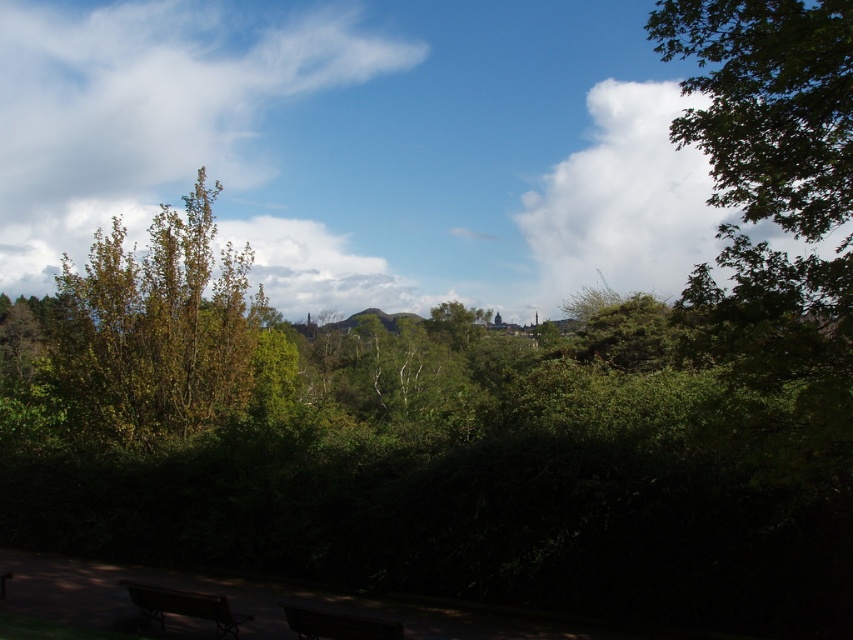
Can you confirm if white fluffy cloud at upper center is positioned above dark brown wooden bench at lower left?

Indeed, white fluffy cloud at upper center is positioned over dark brown wooden bench at lower left.

Who is more forward, (32, 284) or (144, 582)?

Point (144, 582) is in front.

Which is behind, point (410, 292) or point (218, 621)?

The point (410, 292) is more distant.

At what (x,y) coordinates should I click in order to perform the action: click on white fluffy cloud at upper center. Please return your answer as a coordinate pair (x, y). The width and height of the screenshot is (853, 640). Looking at the image, I should click on (318, 268).

Who is higher up, white fluffy cloud at upper left or dark brown wooden bench at lower center?

white fluffy cloud at upper left is higher up.

Which is below, white fluffy cloud at upper left or dark brown wooden bench at lower center?

Positioned lower is dark brown wooden bench at lower center.

Is point (218, 26) positioned after point (395, 628)?

Yes, point (218, 26) is farther from viewer.

You are a GUI agent. You are given a task and a screenshot of the screen. Output one action in this format:
    pyautogui.click(x=<x>, y=<y>)
    Task: Click on the white fluffy cloud at upper left
    This screenshot has width=853, height=640.
    Given the screenshot: What is the action you would take?
    pyautogui.click(x=173, y=134)

Who is positioned more to the right, white fluffy cloud at upper left or white fluffy cloud at upper center?

white fluffy cloud at upper center

Describe the element at coordinates (173, 134) in the screenshot. I see `white fluffy cloud at upper left` at that location.

Where is `white fluffy cloud at upper left`? white fluffy cloud at upper left is located at coordinates (173, 134).